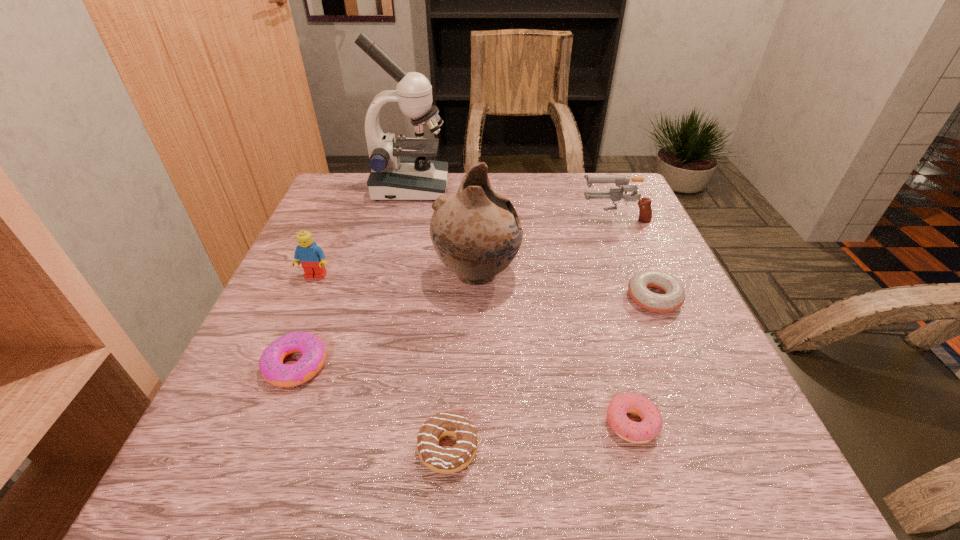
This screenshot has height=540, width=960. In the image, there is a desktop. Identify the location of vacant space at the far edge. (416, 205).

The height and width of the screenshot is (540, 960). In the image, there is a desktop. In order to click on free region at the near edge in this screenshot , I will do `click(650, 487)`.

In the image, there is a desktop. Identify the location of free region at the left edge. The width and height of the screenshot is (960, 540). (259, 339).

In the image, there is a desktop. At what (x,y) coordinates should I click in order to perform the action: click on vacant space at the right edge. Please return your answer as a coordinate pair (x, y). Looking at the image, I should click on (698, 313).

This screenshot has height=540, width=960. In the image, there is a desktop. Identify the location of free region at the far left corner. (371, 215).

I want to click on blank space at the near right corner of the desktop, so click(783, 484).

Find the location of a particular element. vacant area that lies between the Lego and the farthest doughnut is located at coordinates (485, 287).

You are a GUI agent. You are given a task and a screenshot of the screen. Output one action in this format:
    pyautogui.click(x=<x>, y=<y>)
    Task: Click on the free area in between the farthest object and the second doughnut from left to right
    This screenshot has height=540, width=960.
    Given the screenshot: What is the action you would take?
    pyautogui.click(x=429, y=318)

Where is `blank region between the rightmost doughnut and the second tallest object`? Image resolution: width=960 pixels, height=540 pixels. blank region between the rightmost doughnut and the second tallest object is located at coordinates (565, 286).

At what (x,y) coordinates should I click in order to perform the action: click on empty location between the third doughnut from right to left and the microscope. Please return your answer as a coordinate pair (x, y). Looking at the image, I should click on (429, 318).